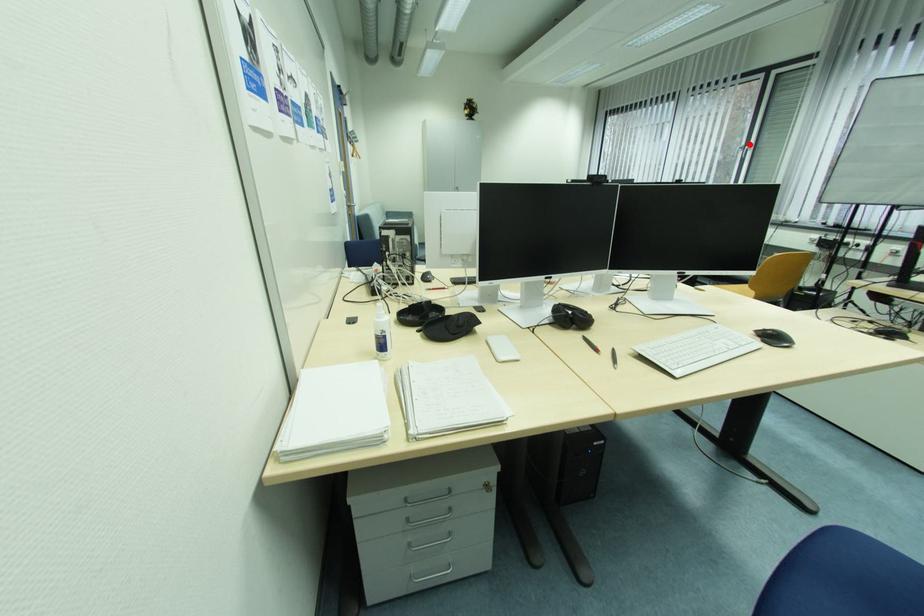
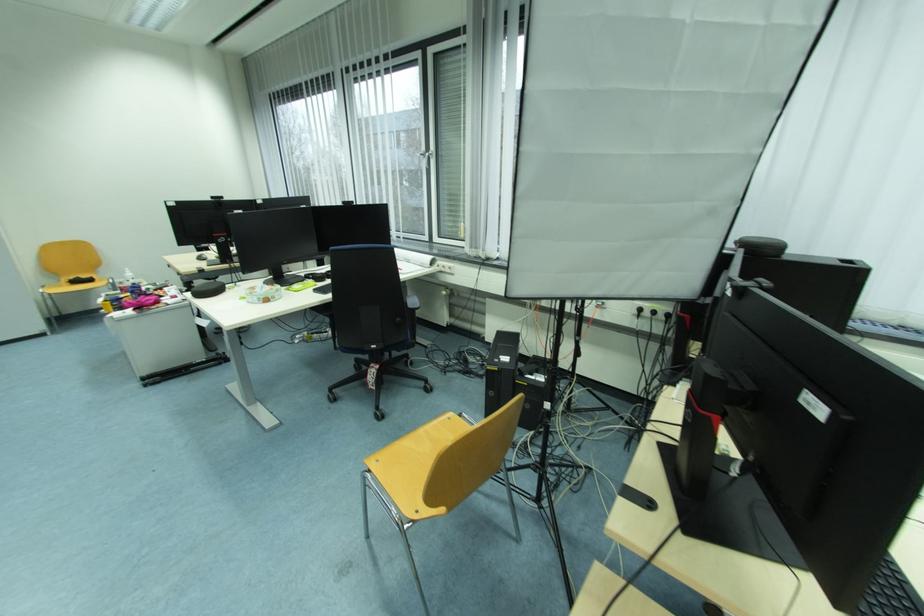
Locate, in the second image, the point that corresponds to the highlighted location in the first image.

(431, 150)